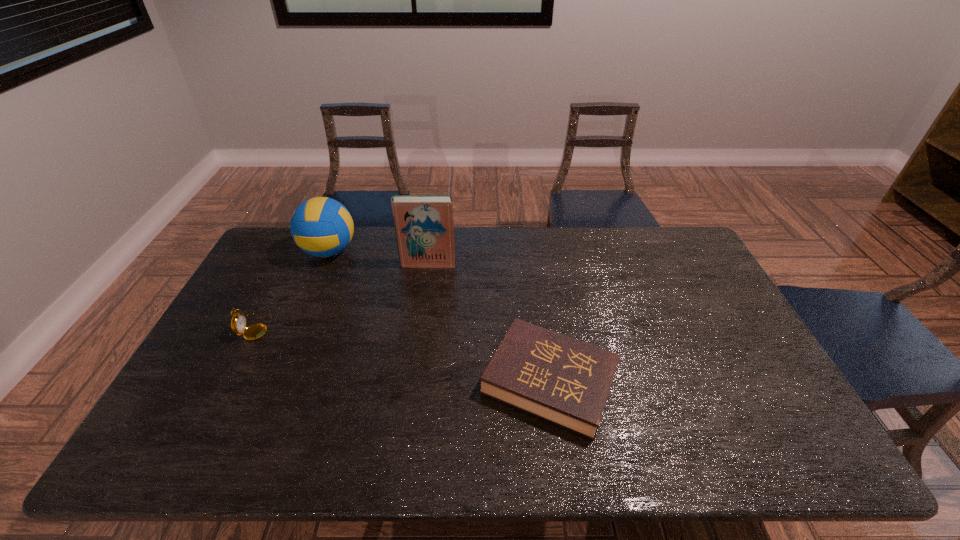
Identify which object is located as the nearest to the left hardback book. Please provide its 2D coordinates. Your answer should be formatted as a tuple, i.e. [(x, y)], where the tuple contains the x and y coordinates of a point satisfying the conditions above.

[(322, 227)]

Where is `the third closest object to the rightmost object`? the third closest object to the rightmost object is located at coordinates (238, 322).

Image resolution: width=960 pixels, height=540 pixels. I want to click on vacant area that satisfies the following two spatial constraints: 1. on the front side of the volleyball; 2. on the face of the pocket watch, so click(297, 327).

Image resolution: width=960 pixels, height=540 pixels. I want to click on vacant region that satisfies the following two spatial constraints: 1. on the cover of the tallest object; 2. on the face of the pocket watch, so click(x=419, y=327).

At what (x,y) coordinates should I click in order to perform the action: click on free spot that satisfies the following two spatial constraints: 1. on the back side of the shorter hardback book; 2. on the face of the pocket watch. Please return your answer as a coordinate pair (x, y). Looking at the image, I should click on pyautogui.click(x=542, y=327).

At what (x,y) coordinates should I click in order to perform the action: click on vacant region that satisfies the following two spatial constraints: 1. on the cover of the shortest object; 2. on the right side of the tallest object. Please return your answer as a coordinate pair (x, y). This screenshot has height=540, width=960. Looking at the image, I should click on (411, 382).

Identify the location of vacant space that satisfies the following two spatial constraints: 1. on the cover of the rightmost object; 2. on the left side of the left hardback book. (411, 382).